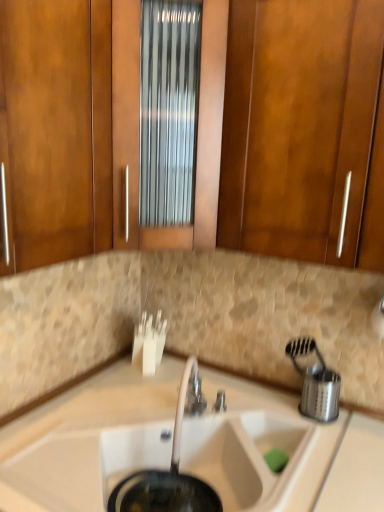
At what (x,y) coordinates should I click in order to perform the action: click on free space behind white ceramic faucet at center. Please return your answer as a coordinate pair (x, y). This screenshot has width=384, height=512. Looking at the image, I should click on (197, 398).